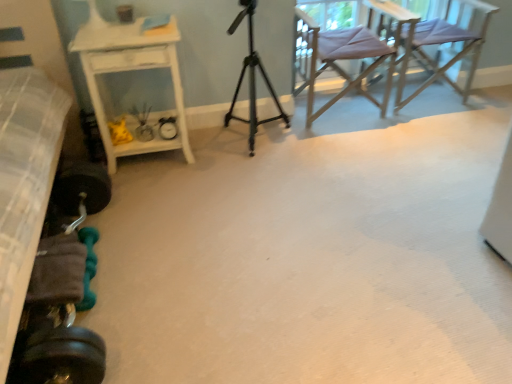
Locate an element on the screen. metallic tripod at center is located at coordinates (252, 79).

This screenshot has height=384, width=512. In order to click on white glossy side table at left in this screenshot , I will do `click(130, 70)`.

In order to face purple fabric chair at upper right, which appears as the second chair when viewed from the right, should I rotate leftwards or rightwards?

You should look right and rotate roughly 11.451 degrees.

I want to click on purple fabric chair at upper right, the first chair viewed from the left, so click(346, 53).

The width and height of the screenshot is (512, 384). Find the location of `light purple fabric chair at upper right, marked as the second chair in a left-to-right arrangement`. light purple fabric chair at upper right, marked as the second chair in a left-to-right arrangement is located at coordinates (446, 44).

Is purple fabric chair at upper right, which appears as the second chair when viewed from the right, closer to camera compared to metallic tripod at center?

No, purple fabric chair at upper right, which appears as the second chair when viewed from the right, is further to the viewer.

Find the location of a particular element. tripod in front of the purple fabric chair at upper right, the first chair viewed from the left is located at coordinates (252, 79).

Consider the image. Who is bigger, purple fabric chair at upper right, the first chair viewed from the left, or metallic tripod at center?

Bigger between the two is purple fabric chair at upper right, the first chair viewed from the left.

Is purple fabric chair at upper right, which appears as the second chair when viewed from the right, inside the boundaries of metallic tripod at center, or outside?

The correct answer is: outside.

Can you confirm if white glossy side table at left is taller than purple fabric chair at upper right, the first chair viewed from the left?

Incorrect, the height of white glossy side table at left is not larger of that of purple fabric chair at upper right, the first chair viewed from the left.

Between white glossy side table at left and purple fabric chair at upper right, the first chair viewed from the left, which one has smaller size?

With smaller size is white glossy side table at left.

Is white glossy side table at left surrounding purple fabric chair at upper right, the first chair viewed from the left?

No.

I want to click on desk in front of the purple fabric chair at upper right, which appears as the second chair when viewed from the right, so click(x=130, y=70).

Between purple fabric chair at upper right, which appears as the second chair when viewed from the right, and textured gray bed at left, which one has larger width?

textured gray bed at left.

Locate an element on the screen. Image resolution: width=512 pixels, height=384 pixels. the 1st chair behind the textured gray bed at left is located at coordinates (346, 53).

Does point (302, 88) come closer to viewer compared to point (25, 132)?

No, it is behind (25, 132).

Would you say textured gray bed at left is part of purple fabric chair at upper right, which appears as the second chair when viewed from the right,'s contents?

No.

How distant is metallic tripod at center from purple fabric chair at upper right, the first chair viewed from the left?

19.54 inches.

From the picture: Looking at their sizes, would you say metallic tripod at center is wider or thinner than purple fabric chair at upper right, the first chair viewed from the left?

In the image, metallic tripod at center appears to be more narrow than purple fabric chair at upper right, the first chair viewed from the left.

Which is further, [287,126] or [362,40]?

The point [287,126] is more distant.

Is metallic tripod at center surrounding purple fabric chair at upper right, which appears as the second chair when viewed from the right?

That's incorrect, purple fabric chair at upper right, which appears as the second chair when viewed from the right, is not inside metallic tripod at center.

From a real-world perspective, does metallic tripod at center sit lower than white glossy side table at left?

Incorrect, from a real-world perspective, metallic tripod at center is higher than white glossy side table at left.

Which object is further away from the camera, metallic tripod at center or white glossy side table at left?

metallic tripod at center is more distant.

Can you confirm if metallic tripod at center is positioned to the left of white glossy side table at left?

No, metallic tripod at center is not to the left of white glossy side table at left.

Between metallic tripod at center and white glossy side table at left, which one has smaller size?

metallic tripod at center.

Can we say purple fabric chair at upper right, which appears as the second chair when viewed from the right, lies outside white glossy side table at left?

purple fabric chair at upper right, which appears as the second chair when viewed from the right, is positioned outside white glossy side table at left.

Is purple fabric chair at upper right, which appears as the second chair when viewed from the right, in contact with white glossy side table at left?

They are not placed beside each other.

Considering the positions of point (386, 34) and point (98, 52), is point (386, 34) closer or farther from the camera than point (98, 52)?

Point (386, 34) is positioned farther from the camera compared to point (98, 52).

Looking at their sizes, would you say light purple fabric chair at upper right, the 1th chair when ordered from right to left, is wider or thinner than purple fabric chair at upper right, which appears as the second chair when viewed from the right?

light purple fabric chair at upper right, the 1th chair when ordered from right to left, is wider than purple fabric chair at upper right, which appears as the second chair when viewed from the right.

In the scene shown: Which is nearer, (450, 5) or (356, 53)?

Point (450, 5) appears to be farther away from the viewer than point (356, 53).

From the picture: Considering the relative sizes of light purple fabric chair at upper right, marked as the second chair in a left-to-right arrangement, and purple fabric chair at upper right, which appears as the second chair when viewed from the right, in the image provided, is light purple fabric chair at upper right, marked as the second chair in a left-to-right arrangement, smaller than purple fabric chair at upper right, which appears as the second chair when viewed from the right,?

No.

What are the coordinates of `chair that is the 1st one below the metallic tripod at center (from a real-world perspective)` in the screenshot? It's located at (346, 53).

Which chair is the 1st one when counting from the back of the white glossy side table at left? Please provide its 2D coordinates.

[(346, 53)]

Estimate the real-world distances between objects in this image. Which object is further from light purple fabric chair at upper right, the 1th chair when ordered from right to left, purple fabric chair at upper right, the first chair viewed from the left, or white glossy side table at left?

white glossy side table at left lies further to light purple fabric chair at upper right, the 1th chair when ordered from right to left, than the other object.

Considering their positions, is light purple fabric chair at upper right, marked as the second chair in a left-to-right arrangement, positioned further to metallic tripod at center than purple fabric chair at upper right, which appears as the second chair when viewed from the right?

light purple fabric chair at upper right, marked as the second chair in a left-to-right arrangement, lies further to metallic tripod at center than the other object.

Considering their positions, is light purple fabric chair at upper right, marked as the second chair in a left-to-right arrangement, positioned closer to purple fabric chair at upper right, which appears as the second chair when viewed from the right, than metallic tripod at center?

light purple fabric chair at upper right, marked as the second chair in a left-to-right arrangement, lies closer to purple fabric chair at upper right, which appears as the second chair when viewed from the right, than the other object.

From the image, which object appears to be nearer to metallic tripod at center, white glossy side table at left or light purple fabric chair at upper right, the 1th chair when ordered from right to left?

The object closer to metallic tripod at center is white glossy side table at left.

Considering their positions, is white glossy side table at left positioned further to textured gray bed at left than metallic tripod at center?

metallic tripod at center.

Considering their positions, is purple fabric chair at upper right, which appears as the second chair when viewed from the right, positioned closer to textured gray bed at left than light purple fabric chair at upper right, marked as the second chair in a left-to-right arrangement?

purple fabric chair at upper right, which appears as the second chair when viewed from the right, lies closer to textured gray bed at left than the other object.

Looking at the image, which one is located further to purple fabric chair at upper right, which appears as the second chair when viewed from the right, textured gray bed at left or white glossy side table at left?

textured gray bed at left.

Which object lies nearer to the anchor point white glossy side table at left, purple fabric chair at upper right, the first chair viewed from the left, or light purple fabric chair at upper right, the 1th chair when ordered from right to left?

purple fabric chair at upper right, the first chair viewed from the left.

In order to click on chair between white glossy side table at left and light purple fabric chair at upper right, the 1th chair when ordered from right to left, in the horizontal direction in this screenshot , I will do `click(346, 53)`.

This screenshot has height=384, width=512. Identify the location of tripod between textured gray bed at left and light purple fabric chair at upper right, the 1th chair when ordered from right to left. (252, 79).

Where is `chair situated between textured gray bed at left and light purple fabric chair at upper right, the 1th chair when ordered from right to left, from left to right`? chair situated between textured gray bed at left and light purple fabric chair at upper right, the 1th chair when ordered from right to left, from left to right is located at coordinates (346, 53).

Locate an element on the screen. This screenshot has width=512, height=384. chair between metallic tripod at center and light purple fabric chair at upper right, the 1th chair when ordered from right to left is located at coordinates (346, 53).